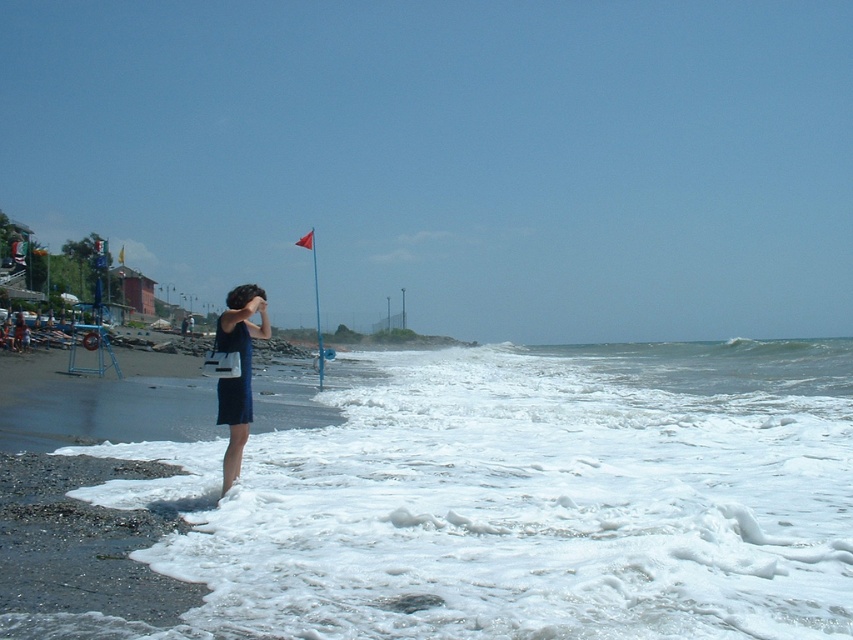
Question: Does white foamy water at lower left appear on the left side of matte blue dress at center?

Choices:
 (A) yes
 (B) no

Answer: (B)

Question: Which point is farther to the camera?

Choices:
 (A) (550, 468)
 (B) (242, 308)

Answer: (A)

Question: Is white foamy water at lower left further to camera compared to matte blue dress at center?

Choices:
 (A) yes
 (B) no

Answer: (B)

Question: Does white foamy water at lower left appear on the left side of matte blue dress at center?

Choices:
 (A) no
 (B) yes

Answer: (A)

Question: Which object is farther from the camera taking this photo?

Choices:
 (A) matte blue dress at center
 (B) white foamy water at lower left

Answer: (A)